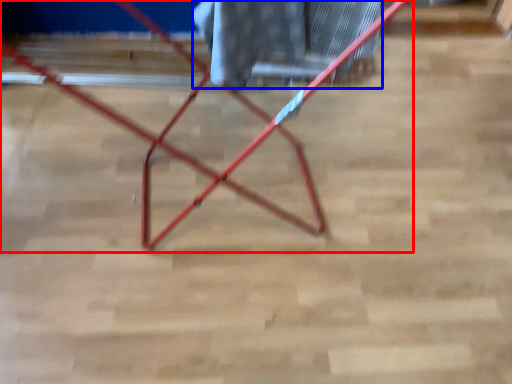
Question: Which object appears farthest to the camera in this image, furniture (highlighted by a red box) or laundry (highlighted by a blue box)?

Choices:
 (A) furniture
 (B) laundry

Answer: (B)